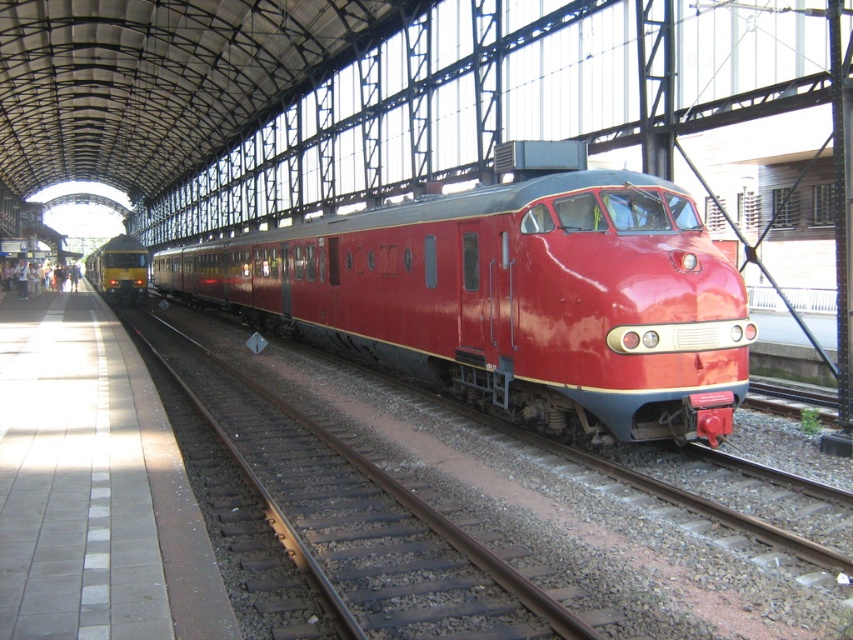
Measure the distance between point (831, 596) and camera.

17.91 feet

The width and height of the screenshot is (853, 640). Identify the location of metal/rusty track at center. (476, 509).

At what (x,y) coordinates should I click in order to perform the action: click on metal/rusty track at center. Please return your answer as a coordinate pair (x, y). Looking at the image, I should click on (476, 509).

Describe the element at coordinates (509, 300) in the screenshot. The image size is (853, 640). I see `glossy red train at center` at that location.

The width and height of the screenshot is (853, 640). Find the location of `glossy red train at center`. glossy red train at center is located at coordinates (509, 300).

Does metal/rusty track at center lie behind glossy red train at center?

No.

In the scene shown: Between metal/rusty track at center and glossy red train at center, which one has more height?

Standing taller between the two is glossy red train at center.

Which is in front, point (393, 429) or point (503, 211)?

Point (503, 211)

This screenshot has height=640, width=853. In order to click on metal/rusty track at center in this screenshot , I will do `click(476, 509)`.